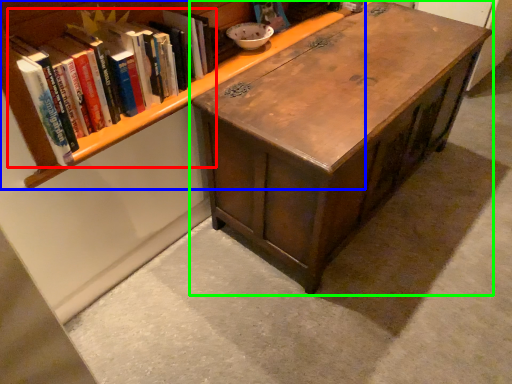
Question: Based on their relative distances, which object is farther from book (highlighted by a red box)? Choose from bookcase (highlighted by a blue box) and table (highlighted by a green box).

Choices:
 (A) bookcase
 (B) table

Answer: (B)